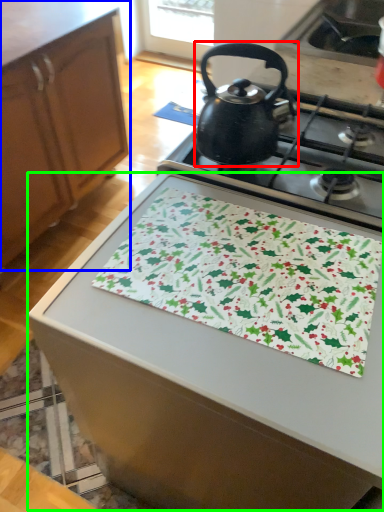
Question: Estimate the real-world distances between objects in this image. Which object is farther from kettle (highlighted by a red box), cabinetry (highlighted by a blue box) or table (highlighted by a green box)?

Choices:
 (A) cabinetry
 (B) table

Answer: (A)